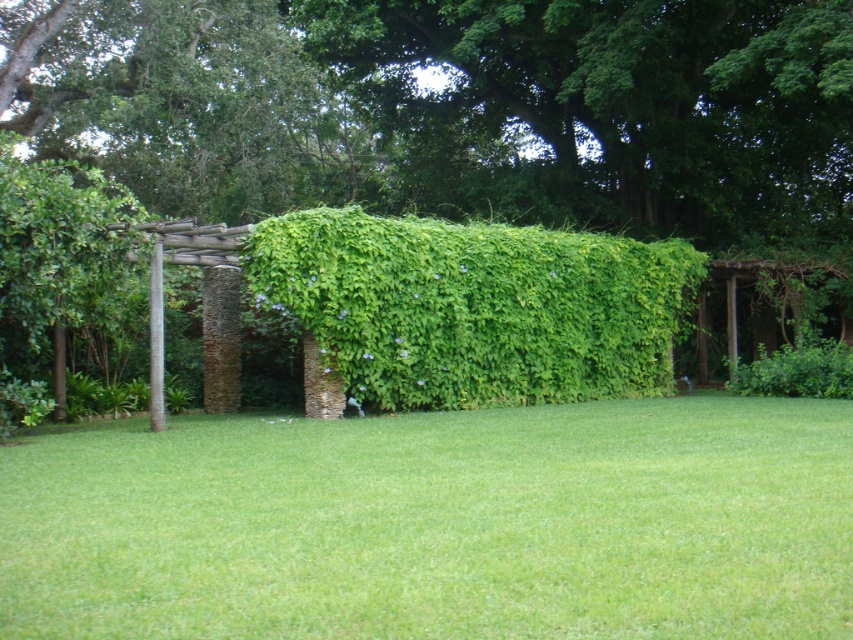
You are standing in a garden and see the green grass at center and the green leafy hedge at center. Which object is positioned to the left?

The green grass at center is to the left of the green leafy hedge at center.

You are designing a garden path and need to know the spatial relationship between the green grass at center and the green leafy hedge at center. Which one is wider?

The green grass at center might be wider than green leafy hedge at center according to the description.

You are standing in the garden and want to place a small garden ornament. Where should you place it to ensure it is on the green grass at center?

Place the ornament at point (437, 524) to ensure it is on the green grass at center.